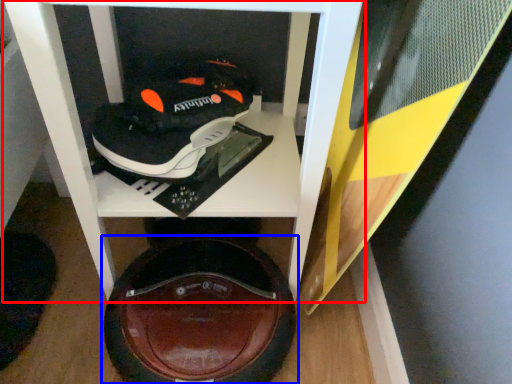
Question: Which point is closer to the camera, furniture (highlighted by a red box) or footwear (highlighted by a blue box)?

Choices:
 (A) furniture
 (B) footwear

Answer: (A)